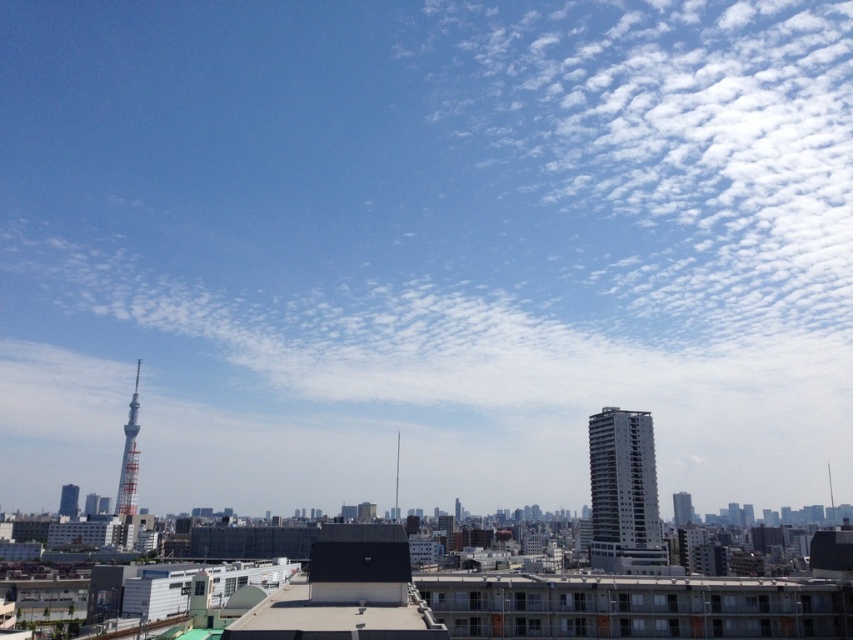
Question: Among these objects, which one is nearest to the camera?

Choices:
 (A) metallic silver tower at left
 (B) white fluffy cloud at upper right
 (C) white concrete building at right

Answer: (C)

Question: Which point is farther to the camera?

Choices:
 (A) (602, 529)
 (B) (581, 42)

Answer: (B)

Question: In this image, where is white fluffy cloud at upper right located relative to white concrete building at right?

Choices:
 (A) above
 (B) below

Answer: (A)

Question: Which object is farther from the camera taking this photo?

Choices:
 (A) white concrete building at right
 (B) white fluffy cloud at upper right

Answer: (B)

Question: Is white fluffy cloud at upper right positioned in front of metallic silver tower at left?

Choices:
 (A) yes
 (B) no

Answer: (B)

Question: Can you confirm if white concrete building at right is smaller than metallic silver tower at left?

Choices:
 (A) no
 (B) yes

Answer: (B)